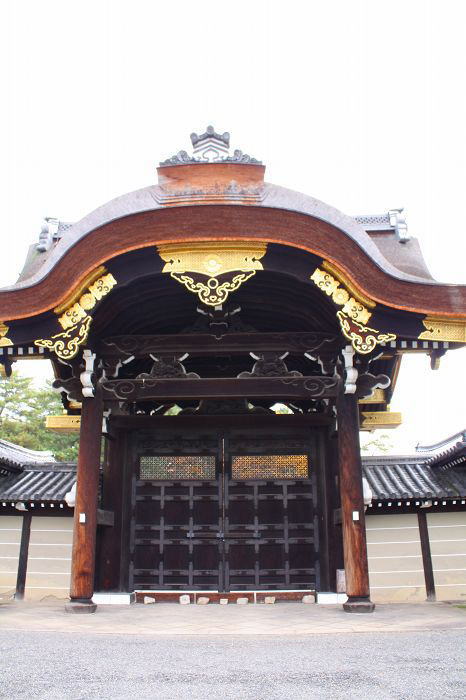
This screenshot has height=700, width=466. In order to click on left door in this screenshot , I will do `click(182, 512)`.